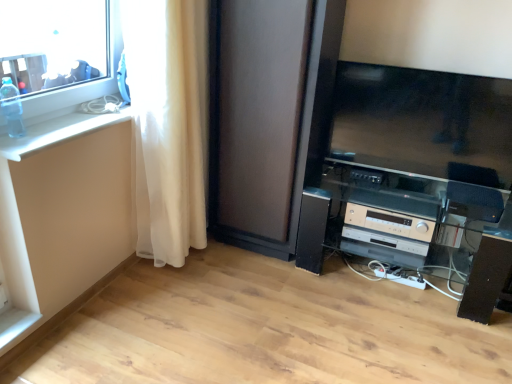
Question: From the image's perspective, is transparent plastic bottle at upper left below beige plastic stereo at lower right?

Choices:
 (A) no
 (B) yes

Answer: (A)

Question: Is beige plastic stereo at lower right at the back of transparent plastic bottle at upper left?

Choices:
 (A) no
 (B) yes

Answer: (A)

Question: Is transparent plastic bottle at upper left shorter than beige plastic stereo at lower right?

Choices:
 (A) no
 (B) yes

Answer: (A)

Question: Does transparent plastic bottle at upper left have a smaller size compared to beige plastic stereo at lower right?

Choices:
 (A) yes
 (B) no

Answer: (A)

Question: Is the depth of transparent plastic bottle at upper left less than that of beige plastic stereo at lower right?

Choices:
 (A) yes
 (B) no

Answer: (A)

Question: Does transparent plastic bottle at upper left appear on the left side of beige plastic stereo at lower right?

Choices:
 (A) no
 (B) yes

Answer: (B)

Question: From the image's perspective, would you say beige plastic stereo at lower right is positioned over transparent plastic bottle at upper left?

Choices:
 (A) no
 (B) yes

Answer: (A)

Question: Is beige plastic stereo at lower right at the left side of transparent plastic bottle at upper left?

Choices:
 (A) yes
 (B) no

Answer: (B)

Question: Considering the relative sizes of beige plastic stereo at lower right and transparent plastic bottle at upper left in the image provided, is beige plastic stereo at lower right shorter than transparent plastic bottle at upper left?

Choices:
 (A) no
 (B) yes

Answer: (B)

Question: Does beige plastic stereo at lower right have a lesser width compared to transparent plastic bottle at upper left?

Choices:
 (A) yes
 (B) no

Answer: (B)

Question: Is beige plastic stereo at lower right positioned behind transparent plastic bottle at upper left?

Choices:
 (A) no
 (B) yes

Answer: (B)

Question: Would you say transparent plastic bottle at upper left is part of beige plastic stereo at lower right's contents?

Choices:
 (A) yes
 (B) no

Answer: (B)

Question: Is white glossy counter top at left facing towards transparent plastic bottle at upper left?

Choices:
 (A) yes
 (B) no

Answer: (B)